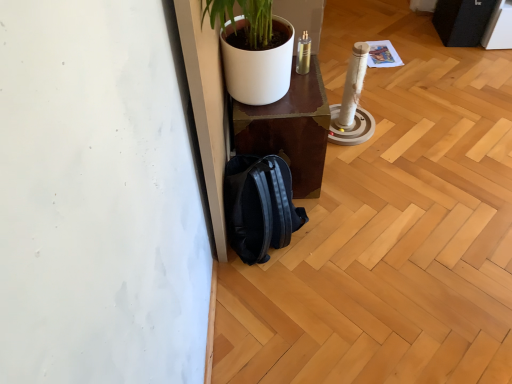
Question: Looking at their shapes, would you say shiny brown table at center is wider or thinner than black matte backpack at lower center?

Choices:
 (A) wide
 (B) thin

Answer: (A)

Question: Does point (252, 139) appear closer or farther from the camera than point (238, 226)?

Choices:
 (A) closer
 (B) farther

Answer: (B)

Question: From a real-world perspective, relative to black matte backpack at lower center, is shiny brown table at center vertically above or below?

Choices:
 (A) below
 (B) above

Answer: (B)

Question: Considering their positions, is black matte backpack at lower center located in front of or behind shiny brown table at center?

Choices:
 (A) behind
 (B) front

Answer: (B)

Question: Considering the positions of black matte backpack at lower center and shiny brown table at center in the image, is black matte backpack at lower center taller or shorter than shiny brown table at center?

Choices:
 (A) tall
 (B) short

Answer: (B)

Question: Is black matte backpack at lower center spatially inside shiny brown table at center, or outside of it?

Choices:
 (A) inside
 (B) outside

Answer: (B)

Question: Visually, is black matte backpack at lower center positioned to the left or to the right of shiny brown table at center?

Choices:
 (A) left
 (B) right

Answer: (A)